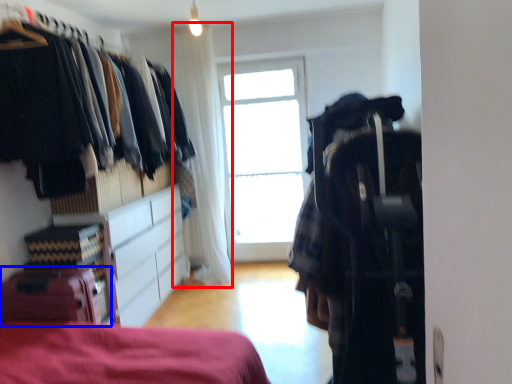
Question: Which object appears farthest to the camera in this image, curtain (highlighted by a red box) or luggage (highlighted by a blue box)?

Choices:
 (A) curtain
 (B) luggage

Answer: (A)